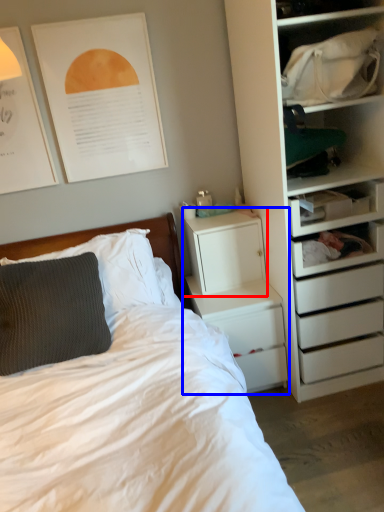
Question: Which of the following is the farthest to the observer, file cabinet (highlighted by a red box) or nightstand (highlighted by a blue box)?

Choices:
 (A) file cabinet
 (B) nightstand

Answer: (A)